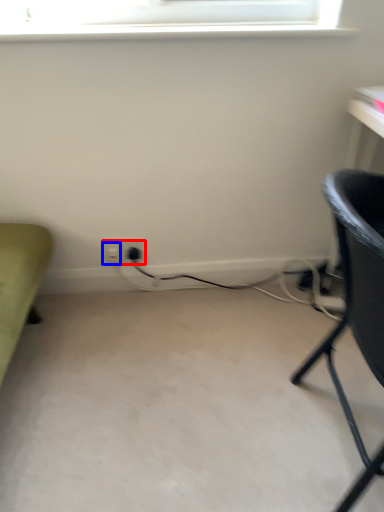
Question: Which object appears closest to the camera in this image, electric outlet (highlighted by a red box) or electric outlet (highlighted by a blue box)?

Choices:
 (A) electric outlet
 (B) electric outlet

Answer: (A)